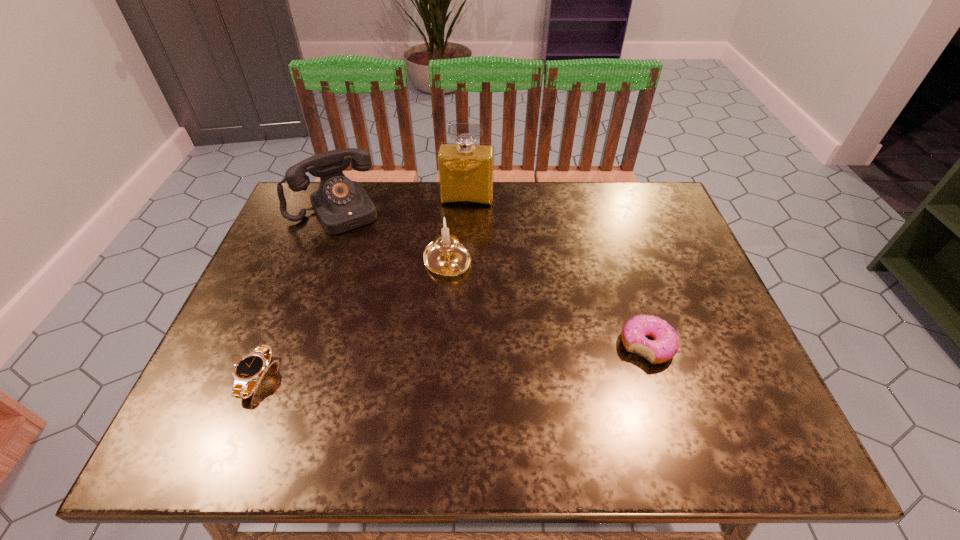
The image size is (960, 540). Find the location of `watch located in the left edge section of the desktop`. watch located in the left edge section of the desktop is located at coordinates (250, 368).

Where is `telephone located in the left edge section of the desktop`? The image size is (960, 540). telephone located in the left edge section of the desktop is located at coordinates [340, 204].

The width and height of the screenshot is (960, 540). In order to click on object present at the right edge in this screenshot , I will do `click(665, 343)`.

Locate an element on the screen. object located in the far left corner section of the desktop is located at coordinates (340, 204).

Identify the location of object present at the near left corner. This screenshot has height=540, width=960. (250, 368).

Where is `free space at the far edge`? free space at the far edge is located at coordinates (532, 192).

Image resolution: width=960 pixels, height=540 pixels. In the image, there is a desktop. In order to click on free region at the near edge in this screenshot , I will do `click(528, 377)`.

The height and width of the screenshot is (540, 960). I want to click on blank space at the left edge of the desktop, so click(288, 238).

Image resolution: width=960 pixels, height=540 pixels. Identify the location of vacant space at the far right corner. (672, 210).

The image size is (960, 540). Identify the location of vacant space in between the doughnut and the telephone. (491, 278).